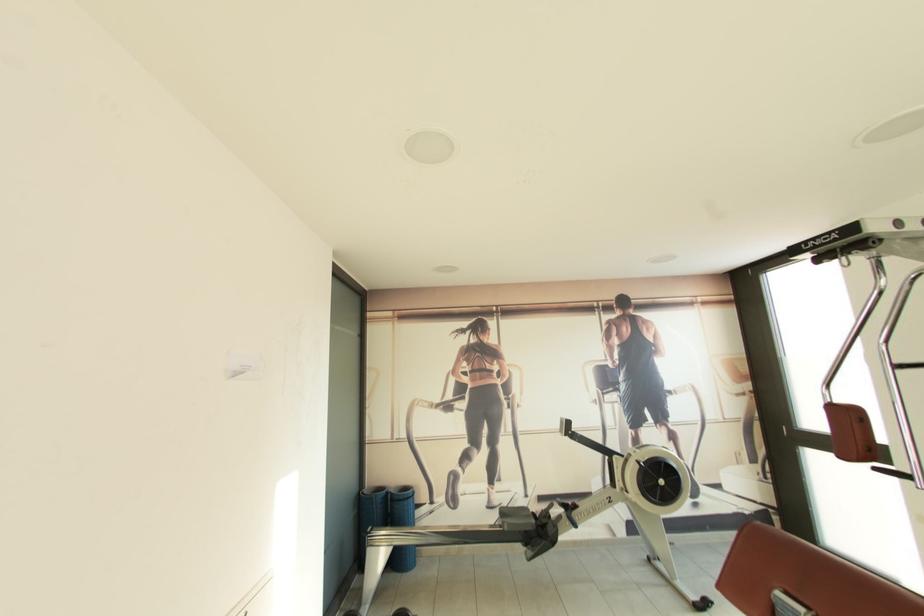
Where would you sit the brown machine seat? Please return your answer as a coordinate pair (x, y).

(804, 578)